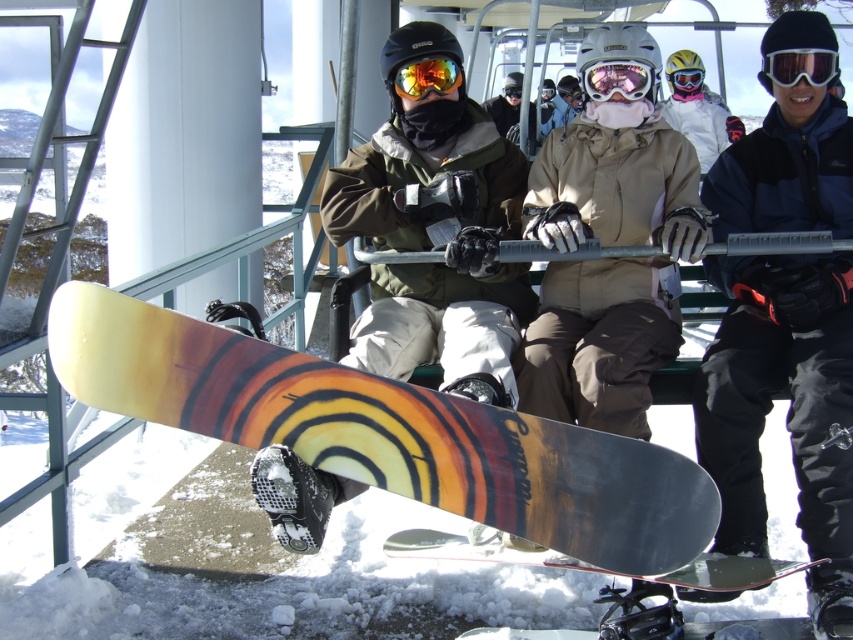
Question: Can you confirm if matte yellow snowboard at center is thinner than pink reflective goggles at center?

Choices:
 (A) no
 (B) yes

Answer: (A)

Question: Estimate the real-world distances between objects in this image. Which object is farther from the matte black snowboard at center?

Choices:
 (A) matte black goggles at center
 (B) yellow matte snowboard at center
 (C) matte yellow goggles at center
 (D) matte yellow snowboard at center

Answer: (A)

Question: Is the position of matte yellow snowboard at center more distant than that of matte black snowboard at center?

Choices:
 (A) yes
 (B) no

Answer: (B)

Question: Is yellow matte snowboard at center to the left of matte black snowboard at center from the viewer's perspective?

Choices:
 (A) no
 (B) yes

Answer: (B)

Question: Which point is farther from the camera taking this photo?

Choices:
 (A) (699, 86)
 (B) (624, 305)
 (C) (633, 61)

Answer: (A)

Question: Among these objects, which one is farthest from the camera?

Choices:
 (A) wooden snowboard at center
 (B) matte yellow goggles at center

Answer: (B)